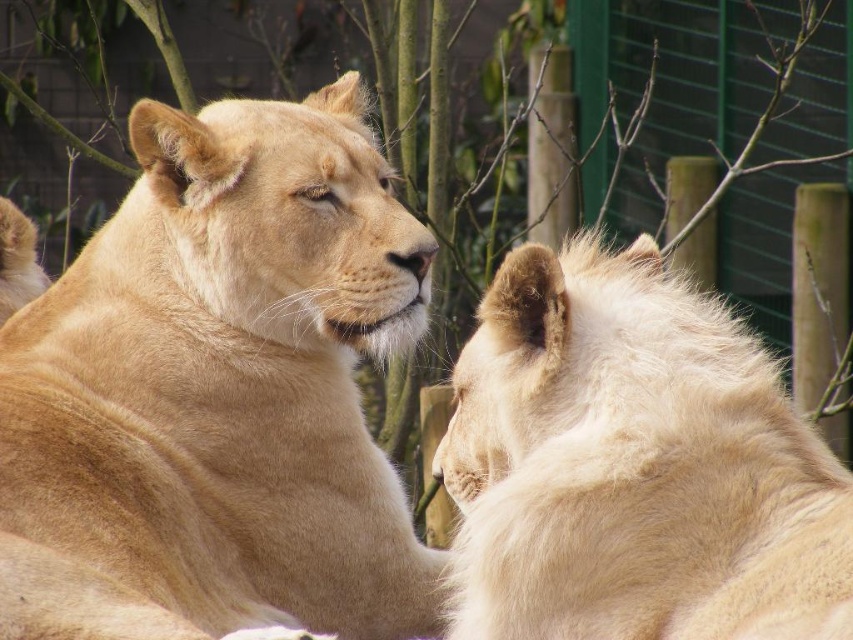
Is golden fur lion at center wider than fuzzy white lion at right?

Correct, the width of golden fur lion at center exceeds that of fuzzy white lion at right.

Is golden fur lion at center positioned before fuzzy white lion at right?

No.

What do you see at coordinates (218, 392) in the screenshot? I see `golden fur lion at center` at bounding box center [218, 392].

At what (x,y) coordinates should I click in order to perform the action: click on golden fur lion at center. Please return your answer as a coordinate pair (x, y). This screenshot has width=853, height=640. Looking at the image, I should click on (218, 392).